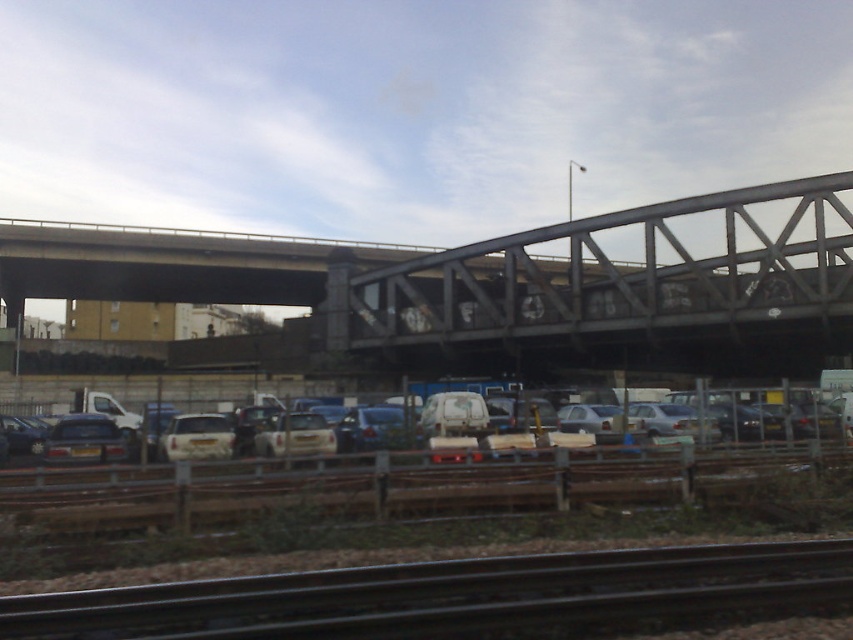
This screenshot has height=640, width=853. What are the coordinates of `metal at bottom` in the screenshot? It's located at (447, 593).

Which is more to the left, metal at bottom or silver metallic van at center?

From the viewer's perspective, silver metallic van at center appears more on the left side.

Between point (706, 602) and point (170, 458), which one is positioned in front?

Point (706, 602) is in front.

This screenshot has width=853, height=640. I want to click on metal at bottom, so click(447, 593).

Between point (256, 624) and point (64, 454), which one is positioned behind?

Point (64, 454)

Is metal at bottom positioned at the back of matte black car at left?

No, it is not.

Is point (757, 600) farther from viewer compared to point (126, 456)?

No, it is in front of (126, 456).

At what (x,y) coordinates should I click in order to perform the action: click on metal at bottom. Please return your answer as a coordinate pair (x, y). This screenshot has height=640, width=853. Looking at the image, I should click on (447, 593).

Does matte black car at left have a lesser width compared to silver metallic car at center?

Incorrect, matte black car at left's width is not less than silver metallic car at center's.

Who is taller, matte black car at left or silver metallic car at center?

Standing taller between the two is silver metallic car at center.

At what (x,y) coordinates should I click in order to perform the action: click on matte black car at left. Please return your answer as a coordinate pair (x, y). Looking at the image, I should click on (85, 440).